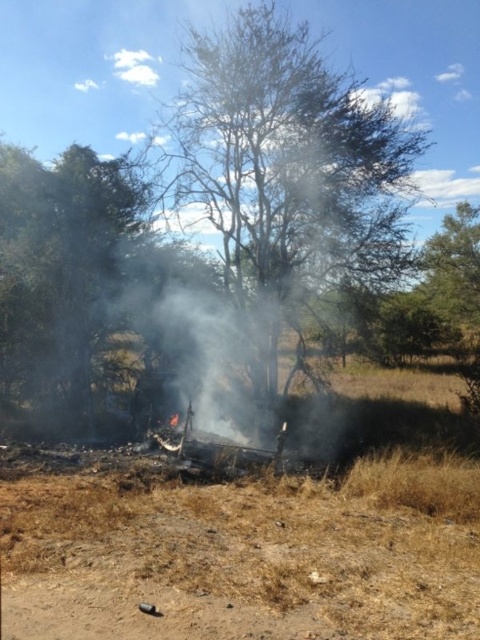
Which is above, brown dry grass at lower center or green leafy tree at left?

Positioned higher is green leafy tree at left.

Between brown dry grass at lower center and green leafy tree at left, which one has less height?

Standing shorter between the two is brown dry grass at lower center.

Is point (376, 496) more distant than point (43, 275)?

No, it is in front of (43, 275).

Where is `brown dry grass at lower center`? brown dry grass at lower center is located at coordinates (229, 563).

Does brown leafy tree at center lie behind green leafy tree at left?

That is False.

Which is more to the right, brown leafy tree at center or green leafy tree at left?

From the viewer's perspective, brown leafy tree at center appears more on the right side.

This screenshot has width=480, height=640. Find the location of `brown leafy tree at center`. brown leafy tree at center is located at coordinates (285, 179).

Between brown dry grass at lower center and brown leafy tree at center, which one appears on the right side from the viewer's perspective?

From the viewer's perspective, brown leafy tree at center appears more on the right side.

Is brown dry grass at lower center further to camera compared to brown leafy tree at center?

That is False.

I want to click on brown dry grass at lower center, so click(229, 563).